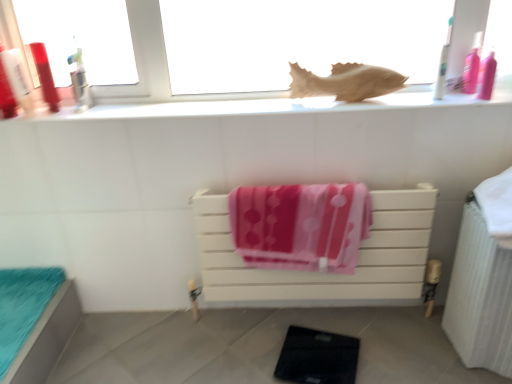
Where is `vacant space that is to the left of white plastic toothbrush at upper right, the second toiletry viewed from the right`? This screenshot has height=384, width=512. vacant space that is to the left of white plastic toothbrush at upper right, the second toiletry viewed from the right is located at coordinates (396, 93).